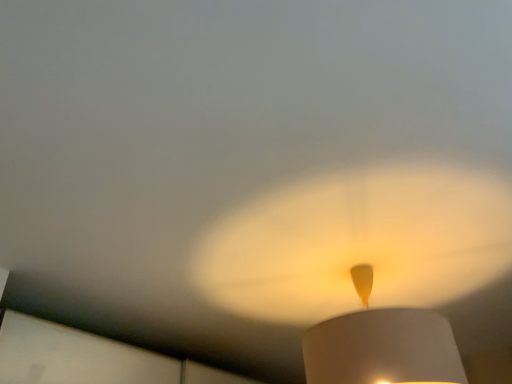
In order to face matte white lampshade at center, should I rotate leftwards or rightwards?

Rotate your view right by about 15.435°.

What do you see at coordinates (381, 345) in the screenshot?
I see `matte white lampshade at center` at bounding box center [381, 345].

Image resolution: width=512 pixels, height=384 pixels. What are the coordinates of `matte white lampshade at center` in the screenshot? It's located at (381, 345).

Where is `matte white lampshade at center`? The width and height of the screenshot is (512, 384). matte white lampshade at center is located at coordinates (381, 345).